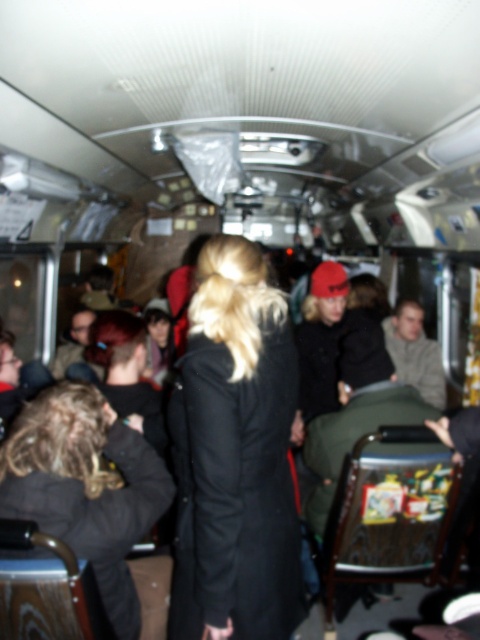
Question: Which point is closer to the camera?

Choices:
 (A) dark brown leather jacket at lower left
 (B) black wool coat at center

Answer: (B)

Question: Which object appears closest to the camera in this image?

Choices:
 (A) black wool coat at center
 (B) dark brown leather jacket at lower left

Answer: (A)

Question: Among these points, which one is farthest from the camera?

Choices:
 (A) (121, 541)
 (B) (245, 465)

Answer: (A)

Question: Can you confirm if black wool coat at center is smaller than dark brown leather jacket at lower left?

Choices:
 (A) yes
 (B) no

Answer: (A)

Question: Can you confirm if black wool coat at center is positioned to the left of dark brown leather jacket at lower left?

Choices:
 (A) no
 (B) yes

Answer: (A)

Question: Is black wool coat at center further to the viewer compared to dark brown leather jacket at lower left?

Choices:
 (A) yes
 (B) no

Answer: (B)